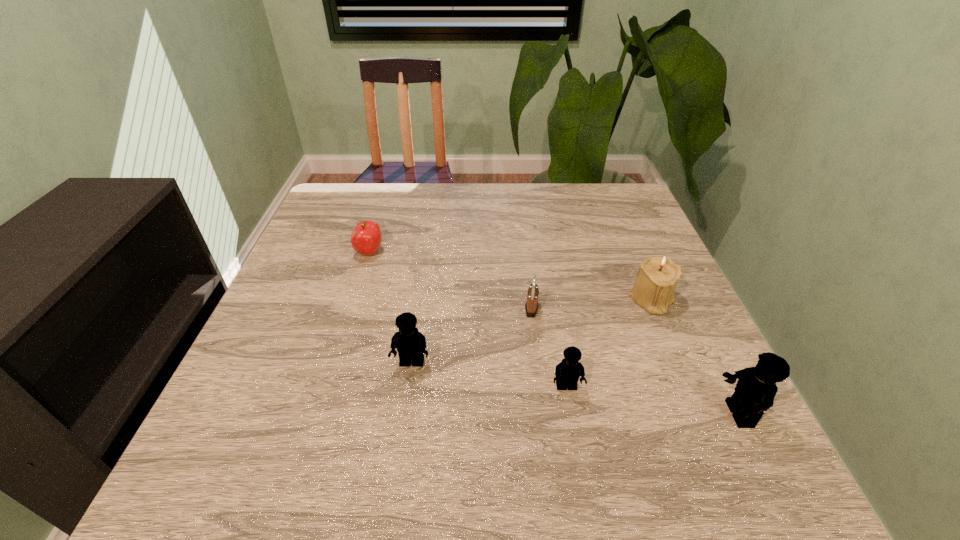
Identify the location of Lego that is the closest to the third object from right to left. Image resolution: width=960 pixels, height=540 pixels. [410, 343].